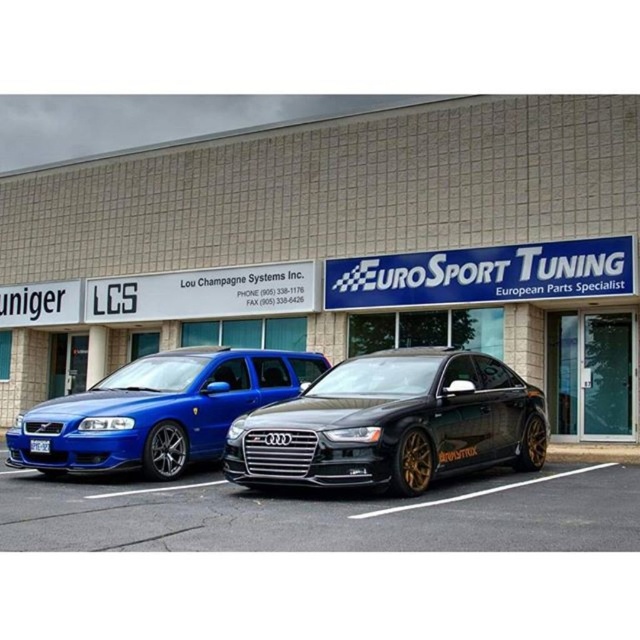
Between metallic blue sedan at center and white plastic license plate at center, which one is positioned higher?

Positioned higher is metallic blue sedan at center.

Between metallic blue sedan at center and white plastic license plate at center, which one appears on the left side from the viewer's perspective?

white plastic license plate at center

The width and height of the screenshot is (640, 640). In order to click on metallic blue sedan at center in this screenshot , I will do `click(157, 410)`.

Can you confirm if black matte audi sedan at center is thinner than metallic blue sedan at center?

No, black matte audi sedan at center is not thinner than metallic blue sedan at center.

Between point (444, 465) and point (12, 440), which one is positioned behind?

The point (12, 440) is behind.

Identify the location of black matte audi sedan at center. Image resolution: width=640 pixels, height=640 pixels. (392, 422).

Is point (412, 324) farther from viewer compared to point (116, 436)?

That is True.

Between point (244, 220) and point (170, 406), which one is positioned behind?

Positioned behind is point (244, 220).

This screenshot has height=640, width=640. Find the location of `metallic blue car at center`. metallic blue car at center is located at coordinates (336, 241).